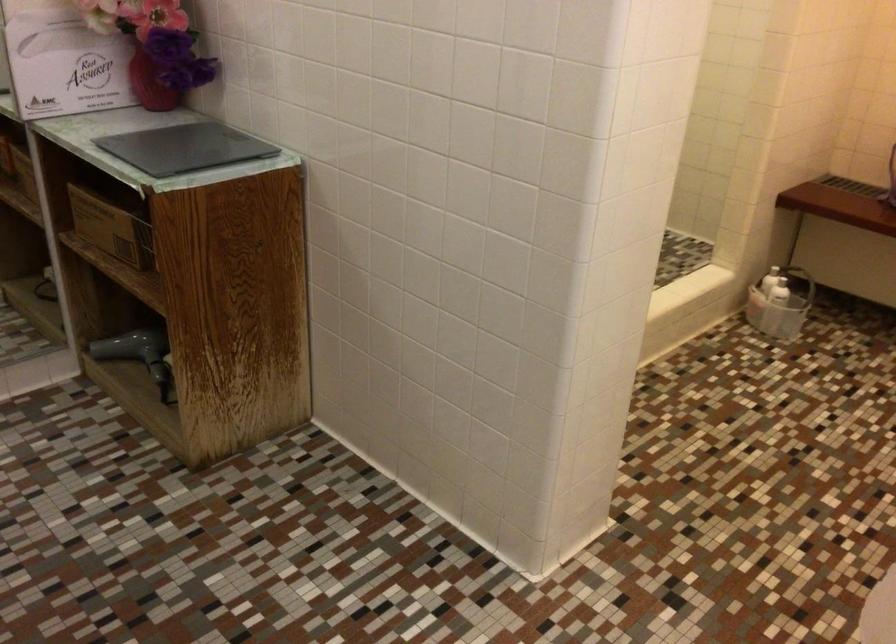
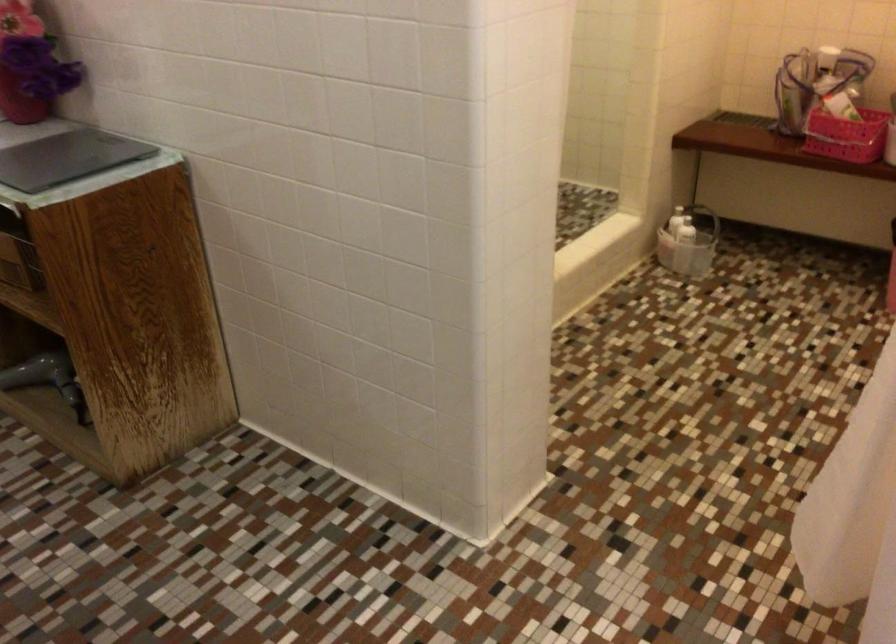
The point at [797,279] is marked in the first image. Where is the corresponding point in the second image?

(703, 216)